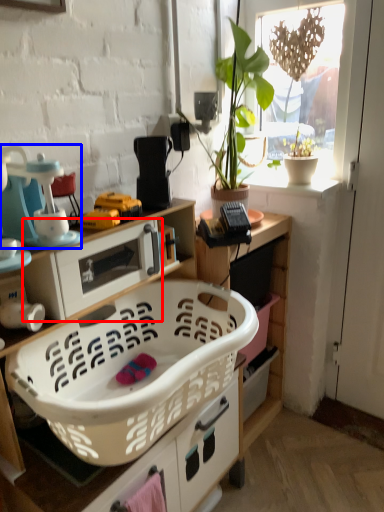
Question: Which object appears closest to the camera in this image, appliance (highlighted by a red box) or appliance (highlighted by a blue box)?

Choices:
 (A) appliance
 (B) appliance

Answer: (B)